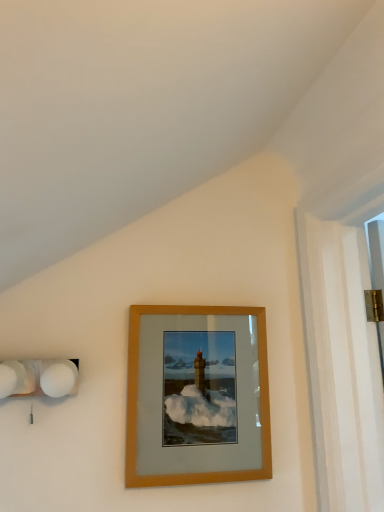
Question: Would you say wooden frame at center is outside white matte spherical lamps at left?

Choices:
 (A) yes
 (B) no

Answer: (A)

Question: From a real-world perspective, is wooden frame at center over white matte spherical lamps at left?

Choices:
 (A) no
 (B) yes

Answer: (A)

Question: Would you say wooden frame at center is a long distance from white matte spherical lamps at left?

Choices:
 (A) yes
 (B) no

Answer: (B)

Question: From the image's perspective, does wooden frame at center appear higher than white matte spherical lamps at left?

Choices:
 (A) yes
 (B) no

Answer: (B)

Question: Is wooden frame at center taller than white matte spherical lamps at left?

Choices:
 (A) yes
 (B) no

Answer: (A)

Question: Is the depth of wooden frame at center greater than that of white matte spherical lamps at left?

Choices:
 (A) no
 (B) yes

Answer: (B)

Question: Can you confirm if white matte spherical lamps at left is thinner than wooden frame at center?

Choices:
 (A) no
 (B) yes

Answer: (A)

Question: From a real-world perspective, is white matte spherical lamps at left physically above wooden frame at center?

Choices:
 (A) no
 (B) yes

Answer: (B)

Question: From a real-world perspective, is white matte spherical lamps at left positioned under wooden frame at center based on gravity?

Choices:
 (A) yes
 (B) no

Answer: (B)

Question: Is white matte spherical lamps at left behind wooden frame at center?

Choices:
 (A) no
 (B) yes

Answer: (A)

Question: Can you confirm if white matte spherical lamps at left is bigger than wooden frame at center?

Choices:
 (A) no
 (B) yes

Answer: (A)

Question: Is white matte spherical lamps at left to the right of wooden frame at center from the viewer's perspective?

Choices:
 (A) yes
 (B) no

Answer: (B)

Question: From a real-world perspective, is white matte spherical lamps at left positioned above or below wooden frame at center?

Choices:
 (A) below
 (B) above

Answer: (B)